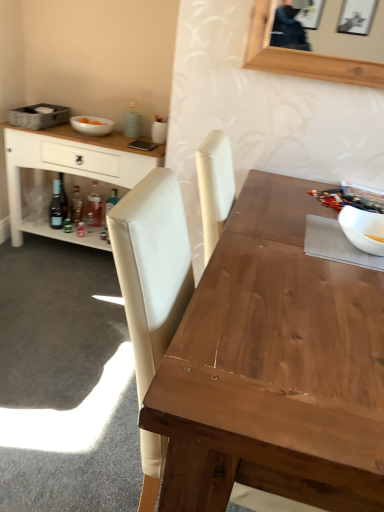
Image resolution: width=384 pixels, height=512 pixels. Find the location of `empty space that is ontop of wooden table at center`. empty space that is ontop of wooden table at center is located at coordinates (309, 282).